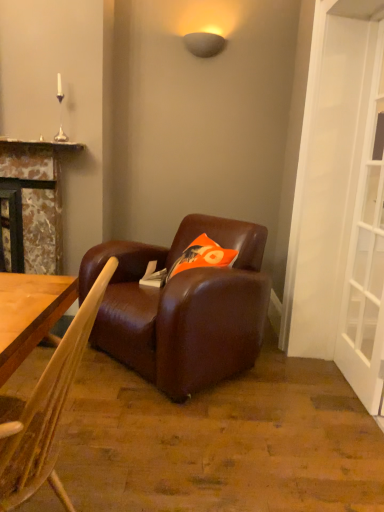
Question: Is brown leather chair at center outside of orange fabric pillow at center?

Choices:
 (A) yes
 (B) no

Answer: (A)

Question: Is brown leather chair at center smaller than orange fabric pillow at center?

Choices:
 (A) no
 (B) yes

Answer: (A)

Question: Is brown leather chair at center far away from orange fabric pillow at center?

Choices:
 (A) yes
 (B) no

Answer: (A)

Question: Considering the relative sizes of brown leather chair at center and orange fabric pillow at center in the image provided, is brown leather chair at center bigger than orange fabric pillow at center?

Choices:
 (A) no
 (B) yes

Answer: (B)

Question: Is brown leather chair at center placed right next to orange fabric pillow at center?

Choices:
 (A) yes
 (B) no

Answer: (B)

Question: Is brown leather couch at center wider or thinner than white glass screen door at right?

Choices:
 (A) wide
 (B) thin

Answer: (A)

Question: Considering the positions of brown leather couch at center and white glass screen door at right in the image, is brown leather couch at center taller or shorter than white glass screen door at right?

Choices:
 (A) short
 (B) tall

Answer: (A)

Question: From the image's perspective, is brown leather couch at center above or below white glass screen door at right?

Choices:
 (A) below
 (B) above

Answer: (A)

Question: Is brown leather couch at center to the left or to the right of white glass screen door at right in the image?

Choices:
 (A) left
 (B) right

Answer: (A)

Question: Looking at the image, does orange fabric pillow at center seem bigger or smaller compared to brown leather chair at center?

Choices:
 (A) small
 (B) big

Answer: (A)

Question: Relative to brown leather chair at center, is orange fabric pillow at center in front or behind?

Choices:
 (A) behind
 (B) front

Answer: (A)

Question: In terms of width, does orange fabric pillow at center look wider or thinner when compared to brown leather chair at center?

Choices:
 (A) wide
 (B) thin

Answer: (B)

Question: From a real-world perspective, relative to brown leather chair at center, is orange fabric pillow at center vertically above or below?

Choices:
 (A) above
 (B) below

Answer: (A)

Question: Relative to brown leather couch at center, is orange fabric pillow at center in front or behind?

Choices:
 (A) front
 (B) behind

Answer: (B)

Question: From a real-world perspective, relative to brown leather couch at center, is orange fabric pillow at center vertically above or below?

Choices:
 (A) above
 (B) below

Answer: (A)